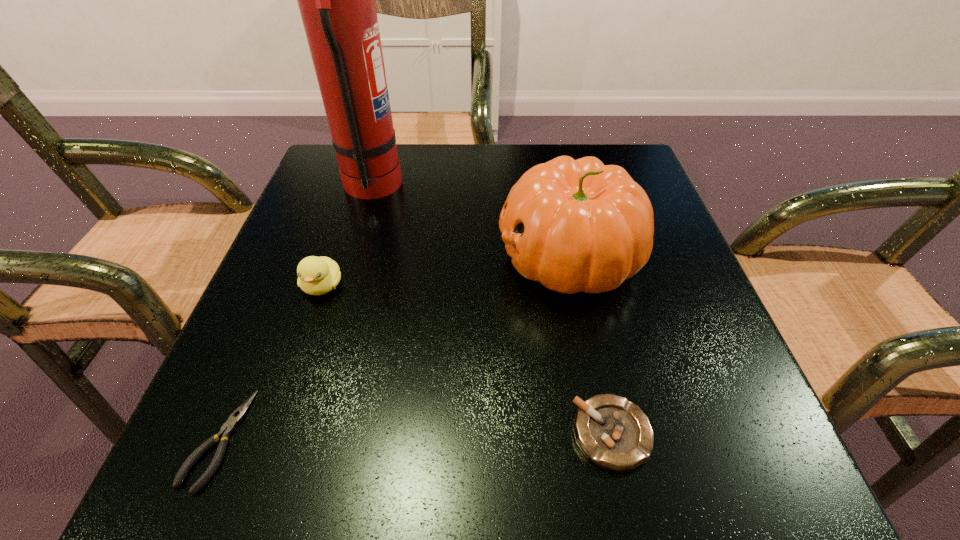
What are the coordinates of `vacant space located on the carved face of the second tallest object` in the screenshot? It's located at (405, 256).

Image resolution: width=960 pixels, height=540 pixels. I want to click on vacant space located 0.260m at the beak of the duckling, so click(x=263, y=461).

The height and width of the screenshot is (540, 960). Find the location of `free location located 0.290m on the back of the ashtray`. free location located 0.290m on the back of the ashtray is located at coordinates (573, 255).

This screenshot has width=960, height=540. In order to click on free space located 0.140m on the back of the pliers in this screenshot , I will do click(271, 314).

Where is `object positioned at the far edge`? object positioned at the far edge is located at coordinates (336, 0).

Identify the location of ashtray that is at the near edge. The width and height of the screenshot is (960, 540). (612, 432).

Find the location of a particular element. pliers that is at the near edge is located at coordinates (228, 428).

In order to click on fire extinguisher that is at the left edge in this screenshot , I will do `click(336, 0)`.

Locate an element on the screen. duckling that is at the left edge is located at coordinates (316, 275).

Find the location of a particular element. The width and height of the screenshot is (960, 540). pliers that is at the left edge is located at coordinates (228, 428).